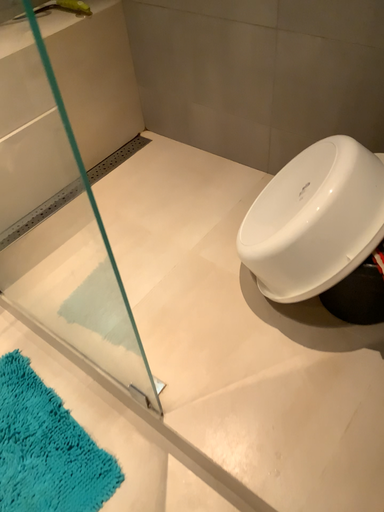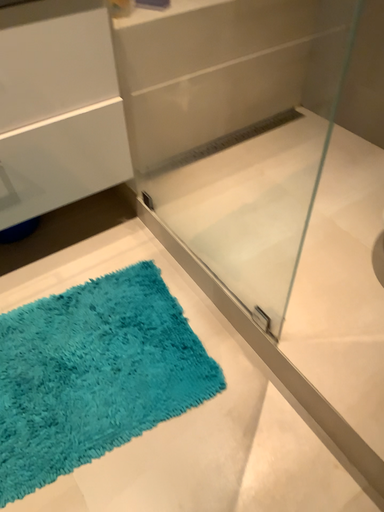
Question: Which way did the camera rotate in the video?

Choices:
 (A) rotated left
 (B) rotated right

Answer: (A)